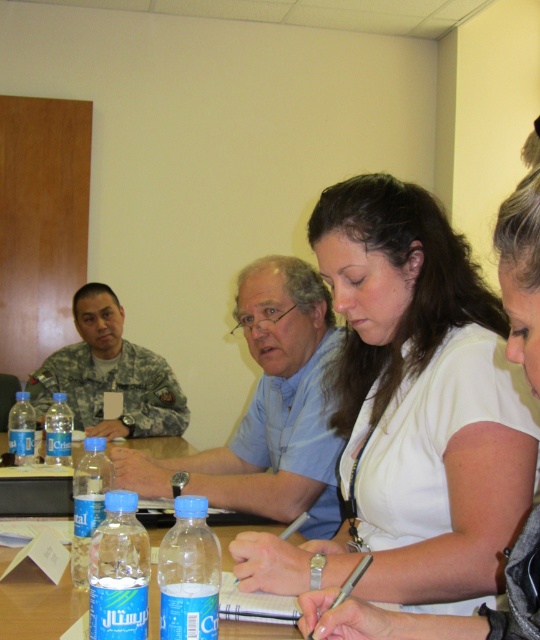
You are organizing a meeting and need to place a name tag on the table. The name tag is 10 cm tall. The blue shirt at center and the clear plastic bottle at left are on the table. Which object is taller than the name tag?

The blue shirt at center is taller than the clear plastic bottle at left, so the blue shirt at center is taller than the name tag.

You are organizing a meeting and need to place a name tag on the blue shirt at center and a water bottle on the blue plastic bottle at lower left. Based on their positions, can you determine which object is higher in the image?

The blue shirt at center is located above the blue plastic bottle at lower left, so the blue shirt at center is higher in the image.

In the scene shown: What are the coordinates of the white matte shirt at center?

The white matte shirt at center is located at coordinates point (411, 410).